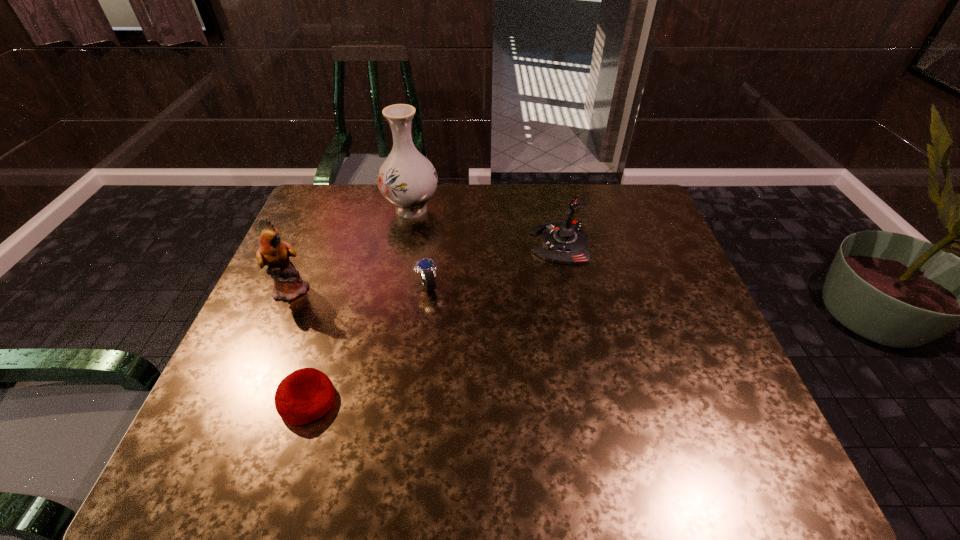
Find the location of a particular element. vacant space situated 0.390m on the handle side of the joystick is located at coordinates (399, 244).

The height and width of the screenshot is (540, 960). Identify the location of vacant region located 0.100m on the handle side of the joystick. (496, 244).

At what (x,y) coordinates should I click in order to perform the action: click on vacant space located on the front of the watch. Please return your answer as a coordinate pair (x, y). The height and width of the screenshot is (540, 960). Looking at the image, I should click on (415, 391).

Locate an element on the screen. The height and width of the screenshot is (540, 960). vacant area situated on the seat area of the nearest object is located at coordinates (396, 401).

Identify the location of vase situated at the far edge. (407, 179).

Identify the location of joystick situated at the far edge. (564, 241).

What are the coordinates of `parrot located in the left edge section of the desktop` in the screenshot? It's located at (288, 284).

Locate an element on the screen. The width and height of the screenshot is (960, 540). beanbag located in the left edge section of the desktop is located at coordinates (305, 395).

This screenshot has width=960, height=540. Identify the location of free space at the far edge of the desktop. (489, 206).

The width and height of the screenshot is (960, 540). I want to click on vacant area at the near edge, so click(x=542, y=452).